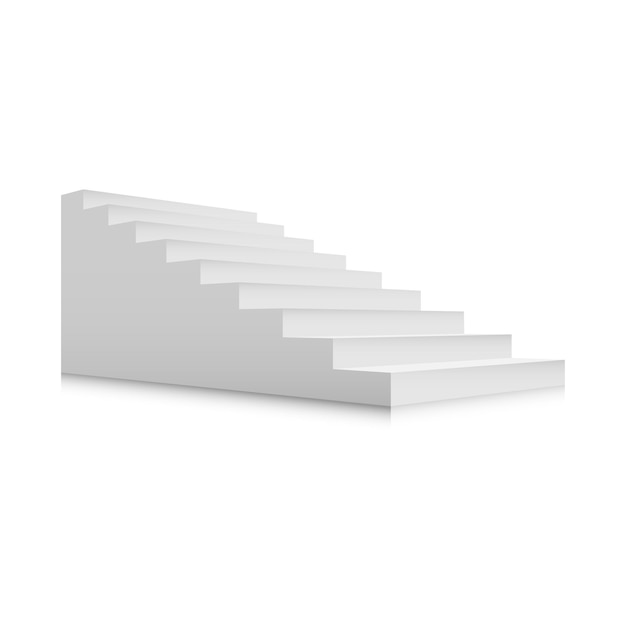
Identify the location of stair step. (403, 382), (380, 355), (346, 327), (304, 294), (280, 275), (258, 255), (239, 240), (226, 223), (213, 215).